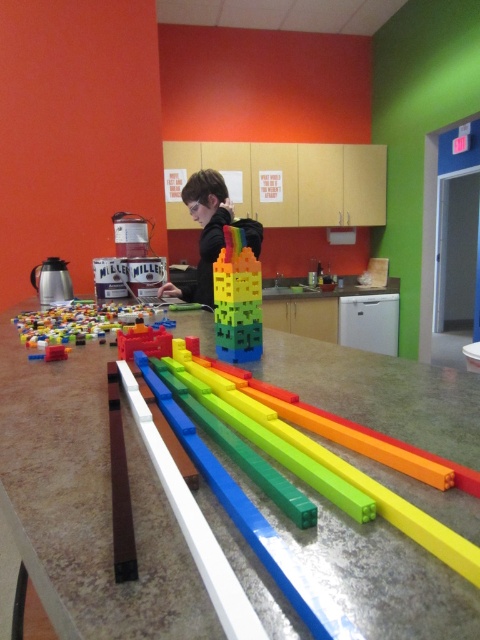
Question: Is rainbow plastic blocks at center below translucent plastic blocks at lower left?

Choices:
 (A) yes
 (B) no

Answer: (B)

Question: Which object appears farthest from the camera in this image?

Choices:
 (A) translucent plastic blocks at lower left
 (B) matte black hoodie at center

Answer: (B)

Question: Can you confirm if smooth plastic table at center is positioned to the left of translucent plastic blocks at lower left?

Choices:
 (A) yes
 (B) no

Answer: (B)

Question: Is rainbow plastic blocks at center behind translucent plastic blocks at lower left?

Choices:
 (A) no
 (B) yes

Answer: (B)

Question: Which object is positioned closest to the matte black hoodie at center?

Choices:
 (A) smooth plastic table at center
 (B) rainbow plastic blocks at center

Answer: (A)

Question: Which object is the farthest from the rainbow plastic blocks at center?

Choices:
 (A) translucent plastic blocks at lower left
 (B) matte black hoodie at center
 (C) smooth plastic table at center

Answer: (B)